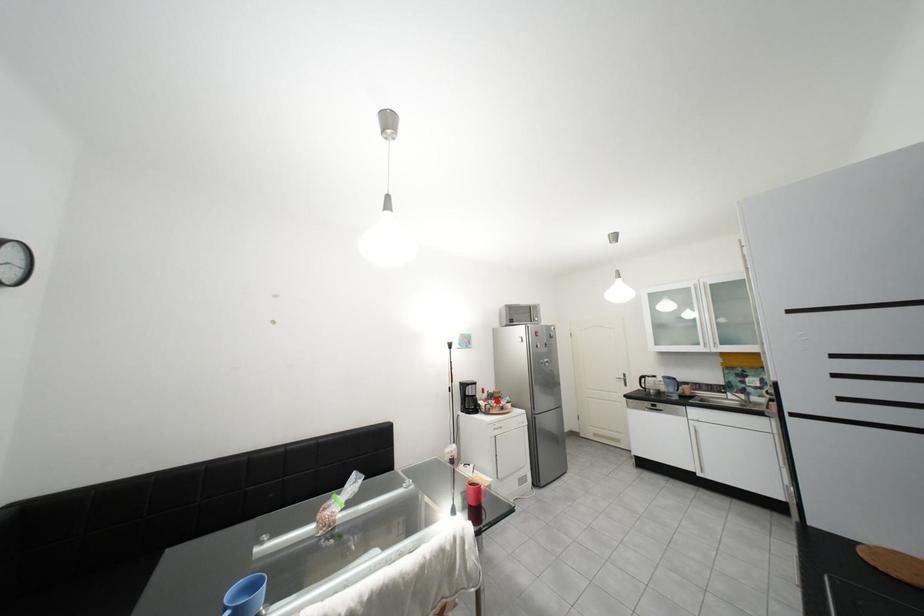
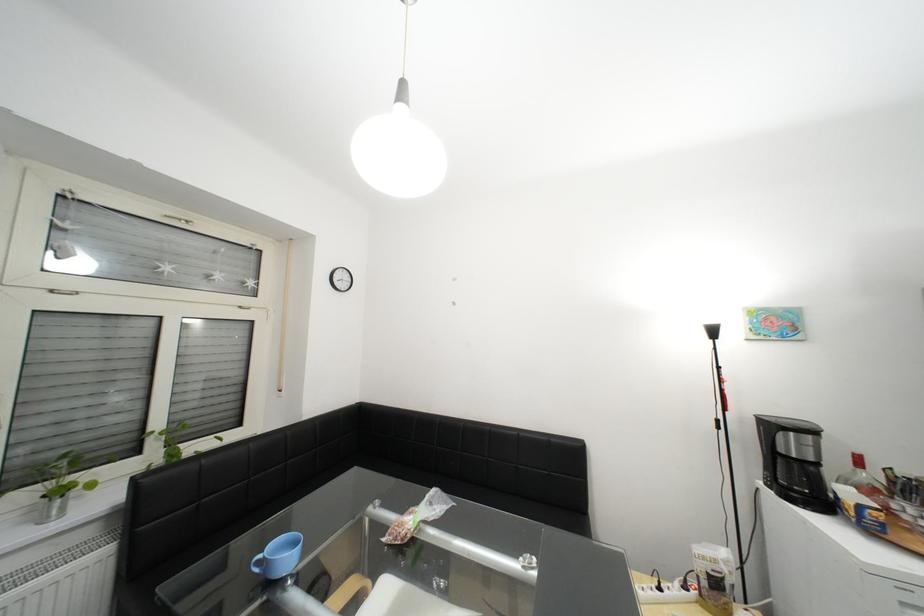
The point at the highlighted location is marked in the first image. Where is the corresponding point in the second image?

(881, 492)